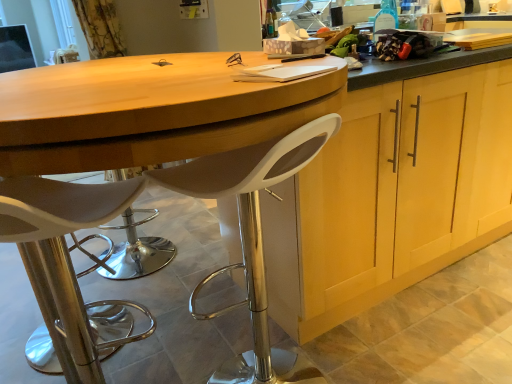
Question: Can we say matte wood cabinet at center lies outside white plastic stool at center, the 2th chair positioned from the left?

Choices:
 (A) no
 (B) yes

Answer: (B)

Question: Is the position of matte wood cabinet at center more distant than that of white plastic stool at center, the 2th chair positioned from the left?

Choices:
 (A) no
 (B) yes

Answer: (B)

Question: Does matte wood cabinet at center have a greater width compared to white plastic stool at center, the first chair when ordered from right to left?

Choices:
 (A) yes
 (B) no

Answer: (A)

Question: Is matte wood cabinet at center bigger than white plastic stool at center, the 2th chair positioned from the left?

Choices:
 (A) yes
 (B) no

Answer: (A)

Question: Is matte wood cabinet at center positioned with its back to white plastic stool at center, the 2th chair positioned from the left?

Choices:
 (A) yes
 (B) no

Answer: (B)

Question: Is matte wood cabinet at center aimed at white plastic stool at center, the 2th chair positioned from the left?

Choices:
 (A) no
 (B) yes

Answer: (A)

Question: Can you confirm if white plastic stool at center, the first chair when ordered from right to left, is thinner than matte wood cabinet at center?

Choices:
 (A) no
 (B) yes

Answer: (B)

Question: From the image's perspective, is white plastic stool at center, the 2th chair positioned from the left, on top of matte wood cabinet at center?

Choices:
 (A) yes
 (B) no

Answer: (B)

Question: Is white plastic stool at center, the first chair when ordered from right to left, in front of matte wood cabinet at center?

Choices:
 (A) no
 (B) yes

Answer: (B)

Question: Does white plastic stool at center, the 2th chair positioned from the left, lie behind matte wood cabinet at center?

Choices:
 (A) yes
 (B) no

Answer: (B)

Question: Is white plastic stool at center, the 2th chair positioned from the left, at the left side of matte wood cabinet at center?

Choices:
 (A) yes
 (B) no

Answer: (A)

Question: Considering the relative positions of white plastic stool at center, the first chair when ordered from right to left, and matte wood cabinet at center in the image provided, is white plastic stool at center, the first chair when ordered from right to left, to the right of matte wood cabinet at center from the viewer's perspective?

Choices:
 (A) no
 (B) yes

Answer: (A)

Question: Is white plastic stool at lower left, the 1th chair when ordered from left to right, to the left of white plastic stool at center, the first chair when ordered from right to left, from the viewer's perspective?

Choices:
 (A) yes
 (B) no

Answer: (A)